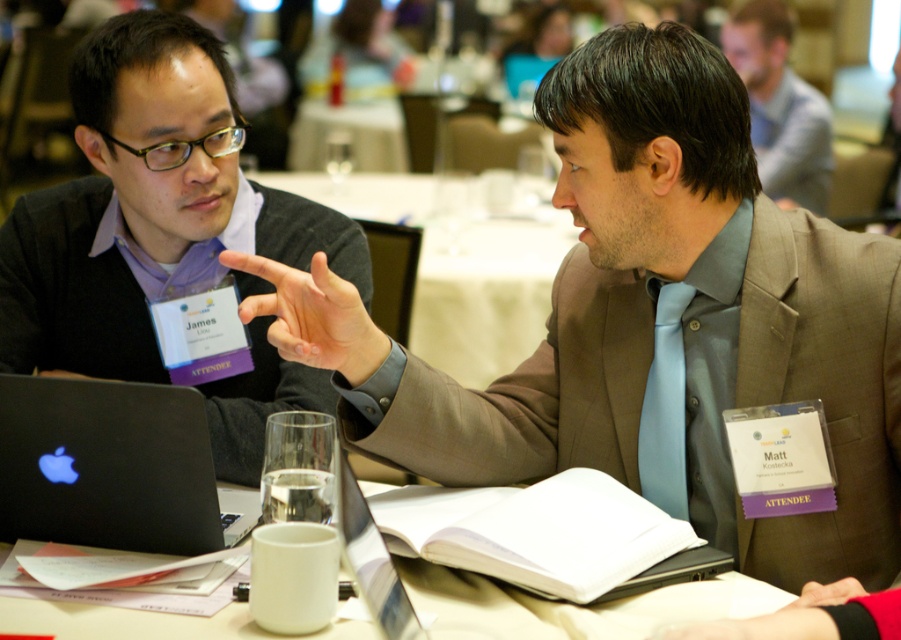
Question: Which object is closer to the camera taking this photo?

Choices:
 (A) light gray suit at upper right
 (B) matte black sweater at left

Answer: (B)

Question: Observing the image, what is the correct spatial positioning of black matte laptop at left in reference to white matte table at center?

Choices:
 (A) left
 (B) right

Answer: (A)

Question: Is the position of light brown suit at center more distant than that of black matte laptop at left?

Choices:
 (A) yes
 (B) no

Answer: (B)

Question: Can you confirm if light brown suit at center is positioned to the right of black matte laptop at left?

Choices:
 (A) no
 (B) yes

Answer: (B)

Question: Among these objects, which one is nearest to the camera?

Choices:
 (A) light blue silk tie at center
 (B) clear glass table at center
 (C) light brown suit at center

Answer: (C)

Question: Which object is the closest to the matte black sweater at left?

Choices:
 (A) black matte laptop at left
 (B) light blue silk tie at center
 (C) white matte table at center
 (D) clear glass table at center

Answer: (A)